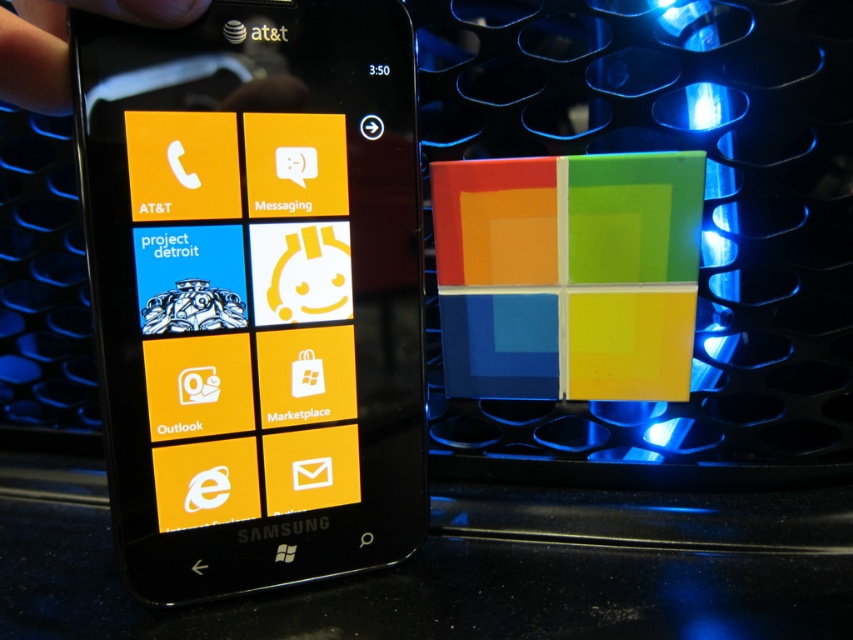
You are a delivery robot that needs to place a small package between the black glossy smartphone at left and the black matte hand at upper left. The package is 20 centimeters long. Will it fit in the space between them?

The distance between the black glossy smartphone at left and the black matte hand at upper left is 21.04 centimeters. Since the package is 20 centimeters long, it will fit in the space between them.

You are holding the black glossy smartphone at left and want to place it on the table next to the black matte hand at upper left. Considering their sizes, which object will occupy more space vertically?

The black glossy smartphone at left is much taller than the black matte hand at upper left, so it will occupy more vertical space when placed on the table.

You are looking at the phone screen and see two points marked on it. One is at coordinate point (213, 13) and the other at point (9, 29). Which point is closer to you?

Point (213, 13) is further to the viewer than point (9, 29), so the point closer to you is point (9, 29).